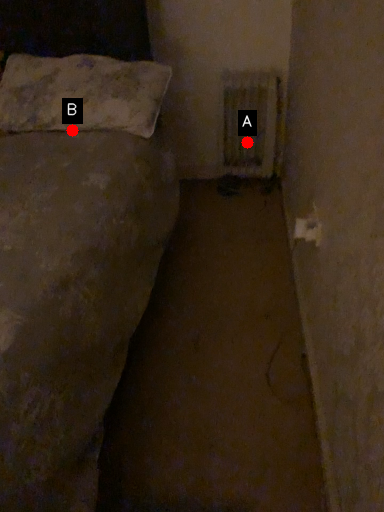
Question: Two points are circled on the image, labeled by A and B beside each circle. Which of the following is the farthest from the observer?

Choices:
 (A) A is further
 (B) B is further

Answer: (A)